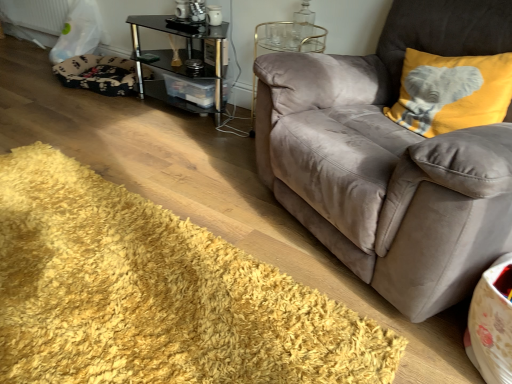
Question: Considering the positions of yellow shaggy rug at lower left and fluffy black and white dog bed at lower left in the image, is yellow shaggy rug at lower left wider or thinner than fluffy black and white dog bed at lower left?

Choices:
 (A) thin
 (B) wide

Answer: (B)

Question: From their relative heights in the image, would you say yellow shaggy rug at lower left is taller or shorter than fluffy black and white dog bed at lower left?

Choices:
 (A) tall
 (B) short

Answer: (B)

Question: Estimate the real-world distances between objects in this image. Which object is farther from the yellow plush pillow at upper right?

Choices:
 (A) suede gray couch at right
 (B) yellow shaggy rug at lower left
 (C) black glass table at center
 (D) fluffy black and white dog bed at lower left

Answer: (D)

Question: Considering the real-world distances, which object is farthest from the yellow plush pillow at upper right?

Choices:
 (A) black glass table at center
 (B) fluffy black and white dog bed at lower left
 (C) suede gray couch at right
 (D) yellow shaggy rug at lower left

Answer: (B)